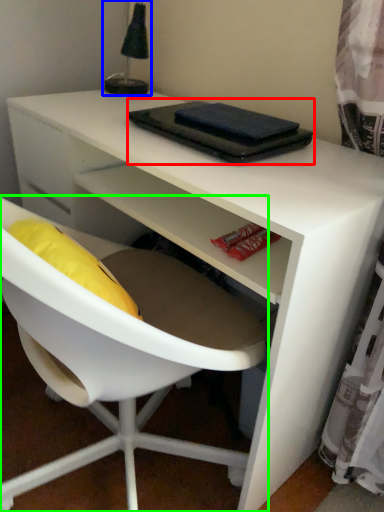
Question: Estimate the real-world distances between objects in this image. Which object is closer to notebook (highlighted by a red box), table lamp (highlighted by a blue box) or chair (highlighted by a green box)?

Choices:
 (A) table lamp
 (B) chair

Answer: (B)